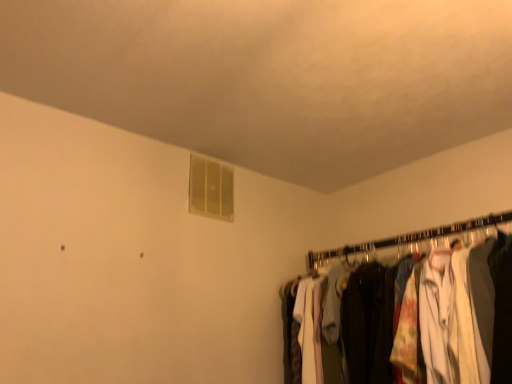
Question: Should I look upward or downward to see white fabric clothes at right?

Choices:
 (A) down
 (B) up

Answer: (A)

Question: From a real-world perspective, is white fabric clothes at right below translucent plastic window at upper center?

Choices:
 (A) no
 (B) yes

Answer: (B)

Question: Is white fabric clothes at right in front of translucent plastic window at upper center?

Choices:
 (A) yes
 (B) no

Answer: (A)

Question: Is white fabric clothes at right surrounding translucent plastic window at upper center?

Choices:
 (A) no
 (B) yes

Answer: (A)

Question: From the image's perspective, is white fabric clothes at right beneath translucent plastic window at upper center?

Choices:
 (A) yes
 (B) no

Answer: (A)

Question: Are white fabric clothes at right and translucent plastic window at upper center far apart?

Choices:
 (A) yes
 (B) no

Answer: (B)

Question: Is white fabric clothes at right next to translucent plastic window at upper center?

Choices:
 (A) no
 (B) yes

Answer: (A)

Question: From the image's perspective, would you say translucent plastic window at upper center is shown under white fabric clothes at right?

Choices:
 (A) no
 (B) yes

Answer: (A)

Question: From a real-world perspective, is translucent plastic window at upper center physically below white fabric clothes at right?

Choices:
 (A) no
 (B) yes

Answer: (A)

Question: Is translucent plastic window at upper center taller than white fabric clothes at right?

Choices:
 (A) yes
 (B) no

Answer: (B)

Question: Is translucent plastic window at upper center smaller than white fabric clothes at right?

Choices:
 (A) yes
 (B) no

Answer: (A)

Question: Does translucent plastic window at upper center have a larger size compared to white fabric clothes at right?

Choices:
 (A) no
 (B) yes

Answer: (A)

Question: Is translucent plastic window at upper center positioned with its back to white fabric clothes at right?

Choices:
 (A) no
 (B) yes

Answer: (A)

Question: In terms of size, does translucent plastic window at upper center appear bigger or smaller than white fabric clothes at right?

Choices:
 (A) big
 (B) small

Answer: (B)